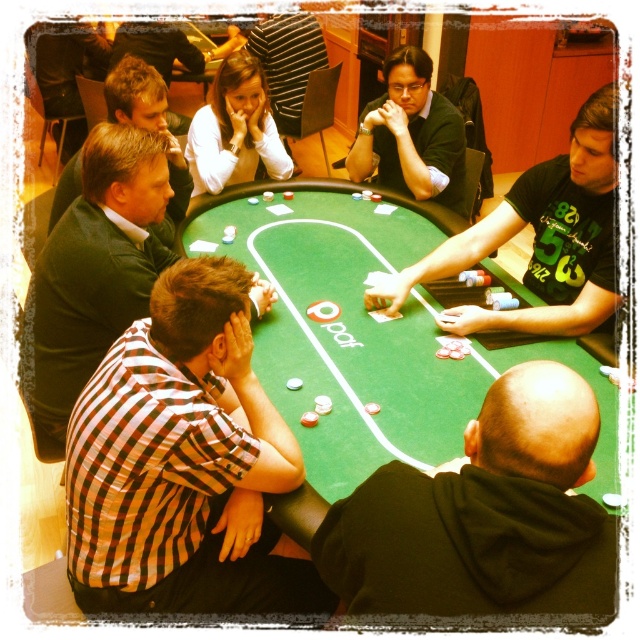
Between point (81, 572) and point (596, 140), which one is positioned in front?

Point (81, 572) is in front.

Can you confirm if checkered fabric shirt at lower left is positioned to the left of green jersey at center?

Correct, you'll find checkered fabric shirt at lower left to the left of green jersey at center.

Between point (77, 481) and point (508, 228), which one is positioned in front?

Point (77, 481) is more forward.

Locate an element on the screen. The image size is (640, 640). checkered fabric shirt at lower left is located at coordinates (182, 461).

Is point (330, 349) closer to camera compared to point (365, 106)?

Yes.

Does green felt table at center appear on the right side of matte black shirt at center?

Incorrect, green felt table at center is not on the right side of matte black shirt at center.

Between point (204, 224) and point (440, 104), which one is positioned behind?

Positioned behind is point (440, 104).

At what (x,y) coordinates should I click in order to perform the action: click on green felt table at center. Please return your answer as a coordinate pair (x, y). Looking at the image, I should click on [x=365, y=332].

From the picture: Does black hoodie at lower right have a greater width compared to green jersey at center?

In fact, black hoodie at lower right might be narrower than green jersey at center.

Which is more to the right, black hoodie at lower right or green jersey at center?

green jersey at center is more to the right.

Between point (436, 499) and point (531, 211), which one is positioned behind?

The point (531, 211) is more distant.

This screenshot has height=640, width=640. Identify the location of black hoodie at lower right. (483, 515).